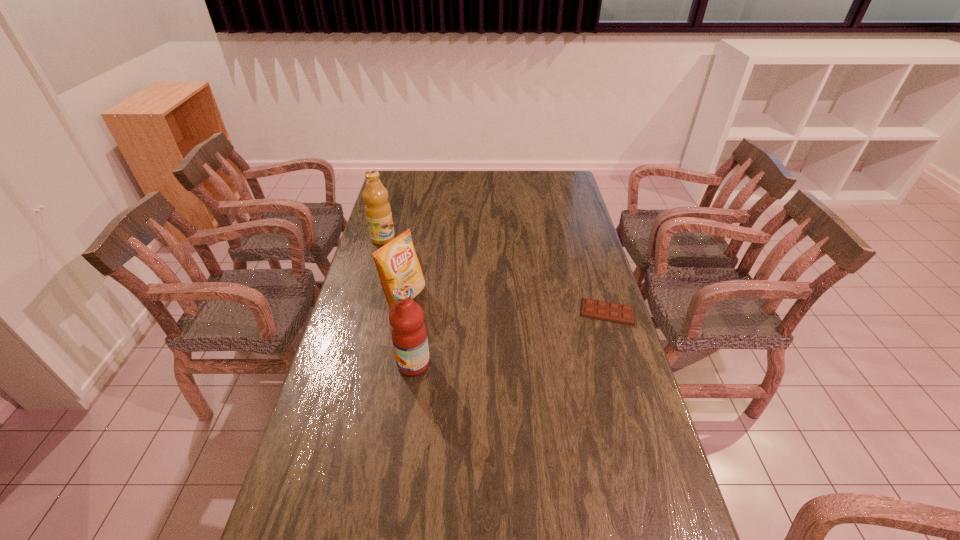
The height and width of the screenshot is (540, 960). I want to click on the nearest object, so click(408, 331).

Identify the location of the rightmost object. (624, 314).

Locate an element on the screen. The image size is (960, 540). chocolate bar is located at coordinates (624, 314).

You are a GUI agent. You are given a task and a screenshot of the screen. Output one action in this format:
    pyautogui.click(x=<x>, y=<y>)
    Task: Click on the third tallest object
    Image resolution: width=960 pixels, height=540 pixels.
    Given the screenshot: What is the action you would take?
    [x=397, y=263]

Locate an element on the screen. the leftmost object is located at coordinates (378, 212).

Find the location of a particular element. Image resolution: width=960 pixels, height=540 pixels. the farthest object is located at coordinates (378, 212).

What are the coordinates of `free space located 0.050m on the front label of the nearest object` in the screenshot? It's located at (380, 363).

Find the location of a particular element. This screenshot has width=960, height=540. blank space located 0.140m on the front label of the nearest object is located at coordinates (351, 363).

The width and height of the screenshot is (960, 540). In order to click on vacant point located 0.060m on the left of the chocolate bar in this screenshot , I will do `click(561, 312)`.

Locate an element on the screen. This screenshot has height=540, width=960. vacant space located 0.360m on the front-facing side of the third tallest object is located at coordinates (507, 355).